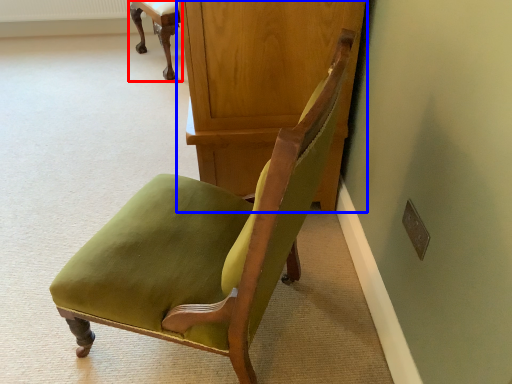
Question: Among these objects, which one is farthest to the camera, chair (highlighted by a red box) or dresser (highlighted by a blue box)?

Choices:
 (A) chair
 (B) dresser

Answer: (A)